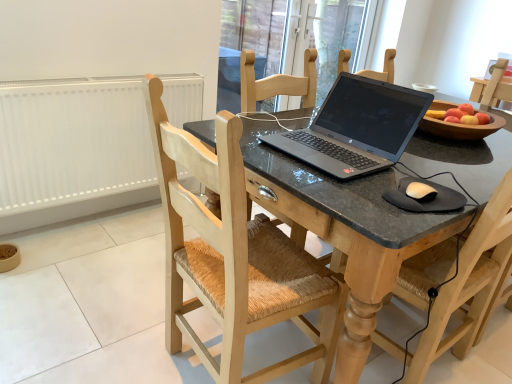
Find the location of a particular element. The height and width of the screenshot is (384, 512). vacant location behind white matte mouse at lower right is located at coordinates (415, 172).